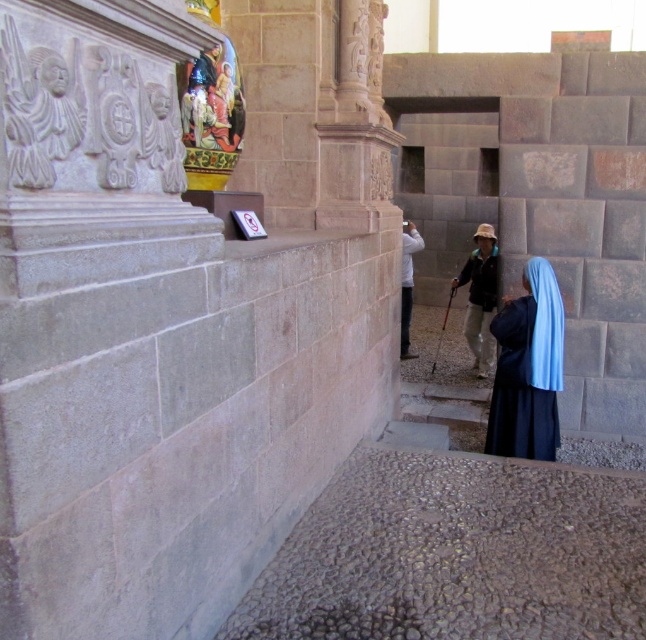
Does black matte robe at center have a lesser width compared to shiny gold vase at upper center?

Incorrect, black matte robe at center's width is not less than shiny gold vase at upper center's.

Is point (466, 276) closer to viewer compared to point (191, 77)?

No.

At what (x,y) coordinates should I click in order to perform the action: click on black matte robe at center. Please return your answer as a coordinate pair (x, y). The height and width of the screenshot is (640, 646). Looking at the image, I should click on (479, 300).

Is point (492, 305) in front of point (410, 310)?

Yes, point (492, 305) is closer to viewer.

Looking at this image, does black matte robe at center lie in front of white matte jacket at center?

Yes, black matte robe at center is in front of white matte jacket at center.

Locate an element on the screen. The image size is (646, 640). black matte robe at center is located at coordinates (479, 300).

Find the location of a particular element. The height and width of the screenshot is (640, 646). black matte robe at center is located at coordinates [x=479, y=300].

Is shiny gold vase at upper center wider than white matte jacket at center?

No.

Can you confirm if shiny gold vase at upper center is smaller than white matte jacket at center?

Correct, shiny gold vase at upper center occupies less space than white matte jacket at center.

Between point (211, 92) and point (410, 282), which one is positioned in front?

Point (211, 92) is more forward.

This screenshot has width=646, height=640. Find the location of `shiny gold vase at upper center`. shiny gold vase at upper center is located at coordinates (202, 100).